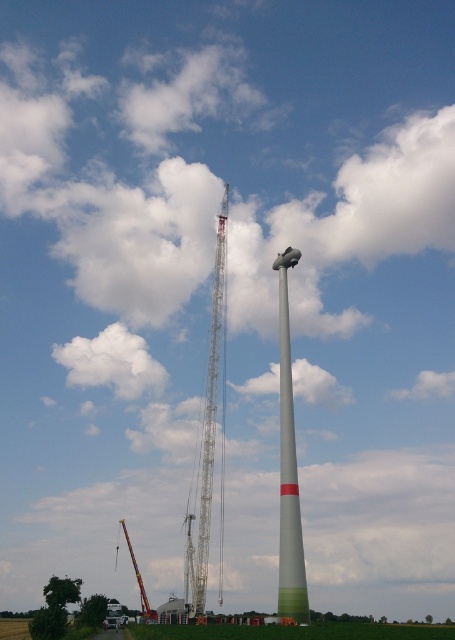
Does metallic lattice tower at center appear on the left side of metallic gray crane at center?

Incorrect, metallic lattice tower at center is not on the left side of metallic gray crane at center.

Is metallic lattice tower at center closer to the viewer compared to metallic gray crane at center?

Yes, it is.

This screenshot has width=455, height=640. What do you see at coordinates (211, 416) in the screenshot?
I see `metallic lattice tower at center` at bounding box center [211, 416].

You are a GUI agent. You are given a task and a screenshot of the screen. Output one action in this format:
    pyautogui.click(x=<x>, y=<y>)
    Task: Click on the metallic lattice tower at center
    Image resolution: width=455 pixels, height=640 pixels.
    Given the screenshot: What is the action you would take?
    pyautogui.click(x=211, y=416)

Which of these two, white matte wind turbine at center or metallic gray crane at center, stands taller?

white matte wind turbine at center is taller.

Does white matte wind turbine at center have a greater height compared to metallic gray crane at center?

Correct, white matte wind turbine at center is much taller as metallic gray crane at center.

The image size is (455, 640). Identify the location of white matte wind turbine at center. pyautogui.click(x=288, y=468).

Locate an element on the screen. white matte wind turbine at center is located at coordinates (288, 468).

Between white matte wind turbine at center and metallic lattice tower at center, which one is positioned higher?

metallic lattice tower at center

Does white matte wind turbine at center have a lesser height compared to metallic lattice tower at center?

Correct, white matte wind turbine at center is not as tall as metallic lattice tower at center.

You are a GUI agent. You are given a task and a screenshot of the screen. Output one action in this format:
    pyautogui.click(x=<x>, y=<y>)
    Task: Click on the white matte wind turbine at center
    
    Given the screenshot: What is the action you would take?
    pyautogui.click(x=288, y=468)